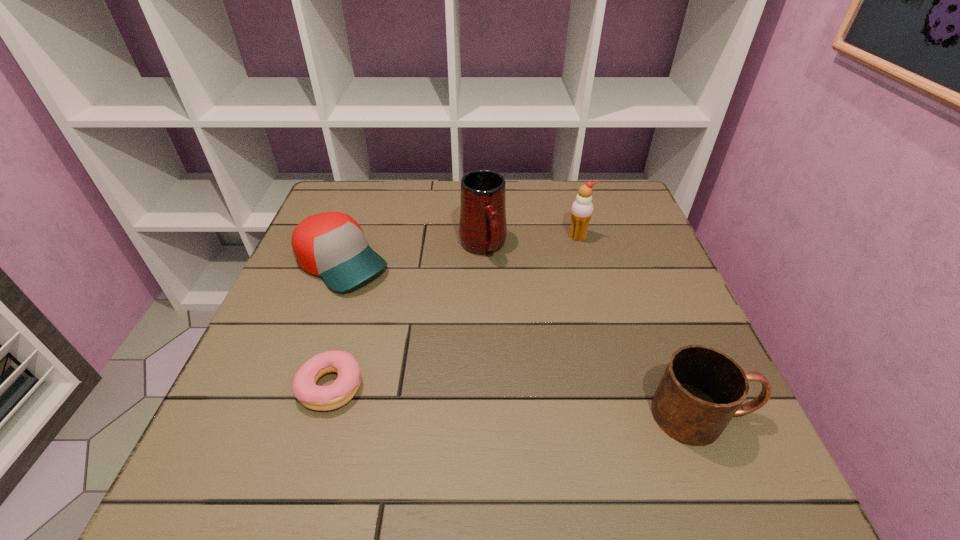
The height and width of the screenshot is (540, 960). I want to click on free space on the desktop that is between the shortest object and the rightmost object and is positioned at the brim of the baseball cap, so click(519, 401).

Identify the location of vacant space on the desktop that is between the shortest object and the rightmost object and is positioned at the front with a straw on the icecream. (563, 404).

Locate an element on the screen. Image resolution: width=960 pixels, height=540 pixels. free space on the desktop that is between the doughnut and the rightmost object and is positioned on the side of the third object from left to right with the handle is located at coordinates (560, 404).